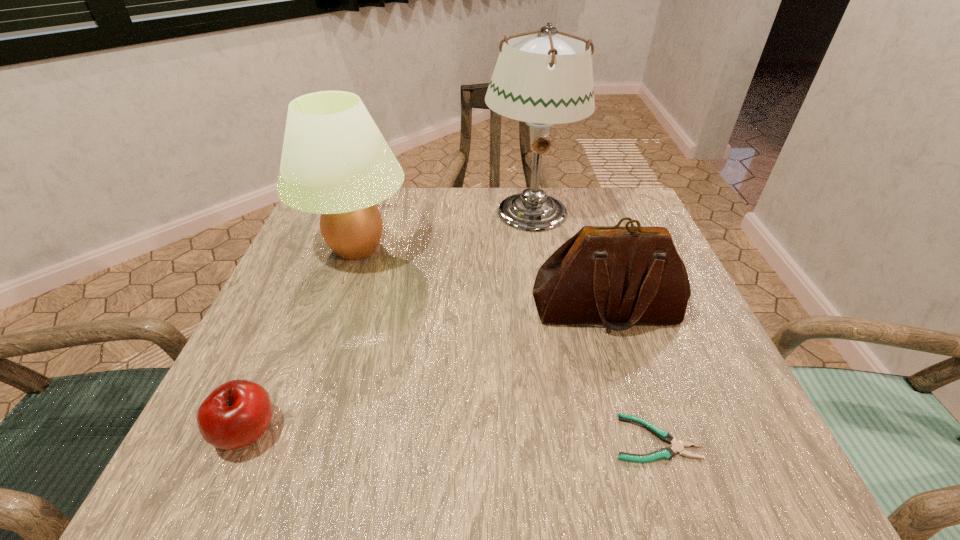
Where is `free location that satisfies the following two spatial constraints: 1. on the lampshade of the shortest object; 2. on the left side of the right lampshade`? This screenshot has width=960, height=540. free location that satisfies the following two spatial constraints: 1. on the lampshade of the shortest object; 2. on the left side of the right lampshade is located at coordinates (565, 438).

Find the location of a particular element. vacant space that satisfies the following two spatial constraints: 1. on the shade of the shorter lampshade; 2. on the left side of the shortest object is located at coordinates (291, 438).